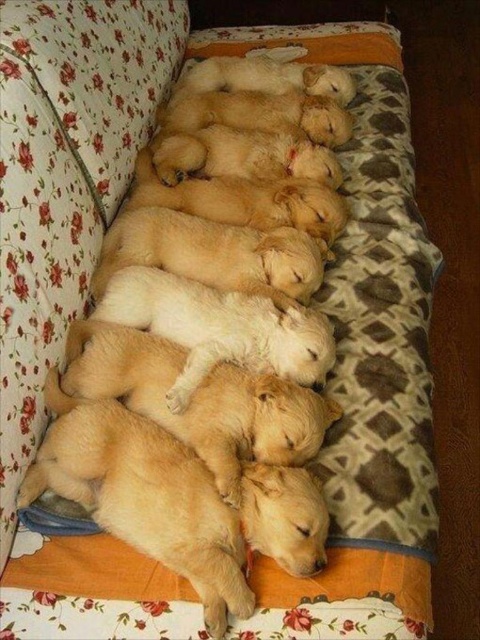
Can you confirm if soft fleece pillow at center is thinner than soft golden fur puppies at center?

No, soft fleece pillow at center is not thinner than soft golden fur puppies at center.

What do you see at coordinates (370, 292) in the screenshot? I see `soft fleece pillow at center` at bounding box center [370, 292].

Measure the distance between soft fleece pillow at center and camera.

The distance of soft fleece pillow at center from camera is 35.43 inches.

In order to click on soft fleece pillow at center in this screenshot , I will do `click(370, 292)`.